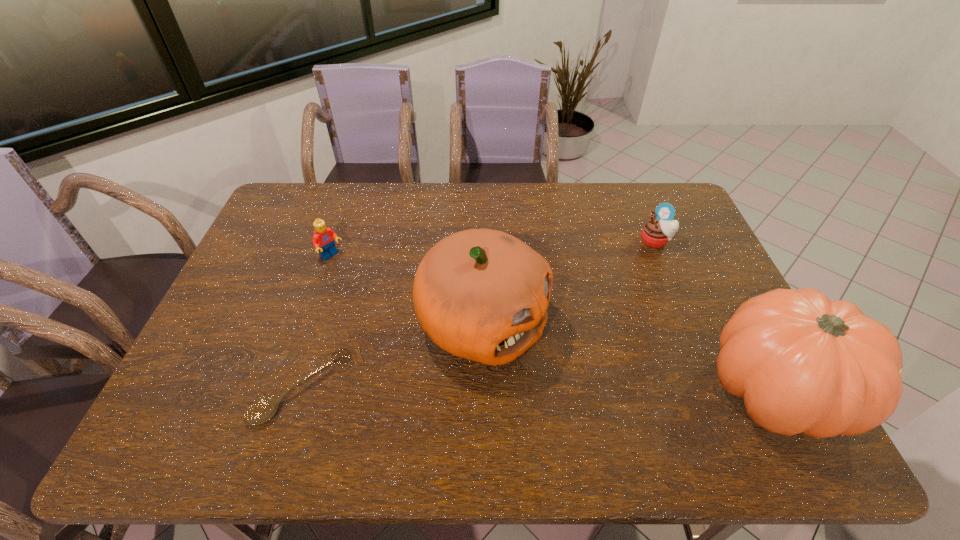
Where is `ladle`? The height and width of the screenshot is (540, 960). ladle is located at coordinates (261, 411).

I want to click on the right pumpkin, so click(804, 364).

At what (x,y) coordinates should I click in order to perform the action: click on Lego. Please return your answer as a coordinate pair (x, y). Looking at the image, I should click on (323, 239).

At what (x,y) coordinates should I click in order to perform the action: click on the left pumpkin. Please return your answer as a coordinate pair (x, y). This screenshot has width=960, height=540. Looking at the image, I should click on (481, 294).

The image size is (960, 540). I want to click on muffin, so click(x=656, y=232).

The image size is (960, 540). In order to click on free space located on the back of the shortest object in this screenshot , I will do `click(329, 303)`.

You are a GUI agent. You are given a task and a screenshot of the screen. Output one action in this format:
    pyautogui.click(x=<x>, y=<y>)
    Task: Click on the vacant space positioned 0.110m on the face of the Lego
    This screenshot has width=960, height=540.
    Given the screenshot: What is the action you would take?
    pyautogui.click(x=359, y=281)

The width and height of the screenshot is (960, 540). Find the location of `free point located 0.350m on the face of the Lego`. free point located 0.350m on the face of the Lego is located at coordinates [x=410, y=325].

Locate an element on the screen. The image size is (960, 540). free region located 0.390m on the face of the Lego is located at coordinates (420, 333).

Locate an element on the screen. The image size is (960, 540). free spot located on the face of the third object from right to left is located at coordinates (629, 400).